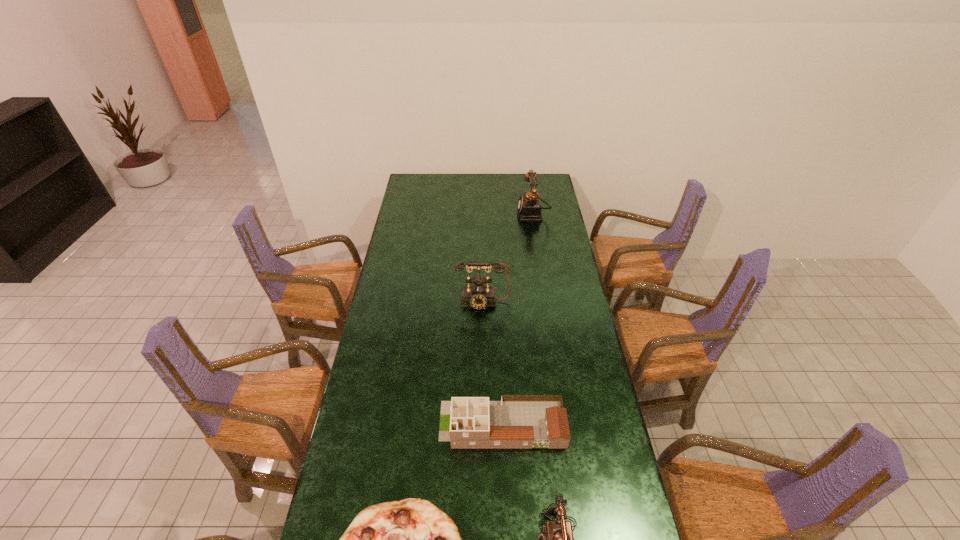
Find the location of `object that ranks as the third closest to the third farthest object`. object that ranks as the third closest to the third farthest object is located at coordinates (478, 295).

Where is `the closest object to the shortest object`? The height and width of the screenshot is (540, 960). the closest object to the shortest object is located at coordinates (517, 421).

This screenshot has height=540, width=960. I want to click on telephone that stands as the closest to the shortest telephone, so (x=478, y=295).

This screenshot has width=960, height=540. Find the location of `the closest telephone to the dollhouse`. the closest telephone to the dollhouse is located at coordinates (557, 539).

The height and width of the screenshot is (540, 960). Identify the location of free space that satisfies the following two spatial constraints: 1. on the front of the farthest telephone at the rotary dial; 2. on the dial of the leftmost telephone. (547, 302).

What are the coordinates of `vacant region that satisfies the following two spatial constraints: 1. on the front of the farthest telephone at the rotary dial; 2. on the dial of the second nearest telephone` in the screenshot? It's located at [x=547, y=302].

Identify the location of vacant space that satisfies the following two spatial constraints: 1. on the front of the farthest object at the rotary dial; 2. on the dial of the second farthest object. The height and width of the screenshot is (540, 960). (547, 302).

Find the location of a particular element. free spot that satisfies the following two spatial constraints: 1. on the front of the farthest telephone at the rotary dial; 2. on the dial of the second farthest telephone is located at coordinates (547, 302).